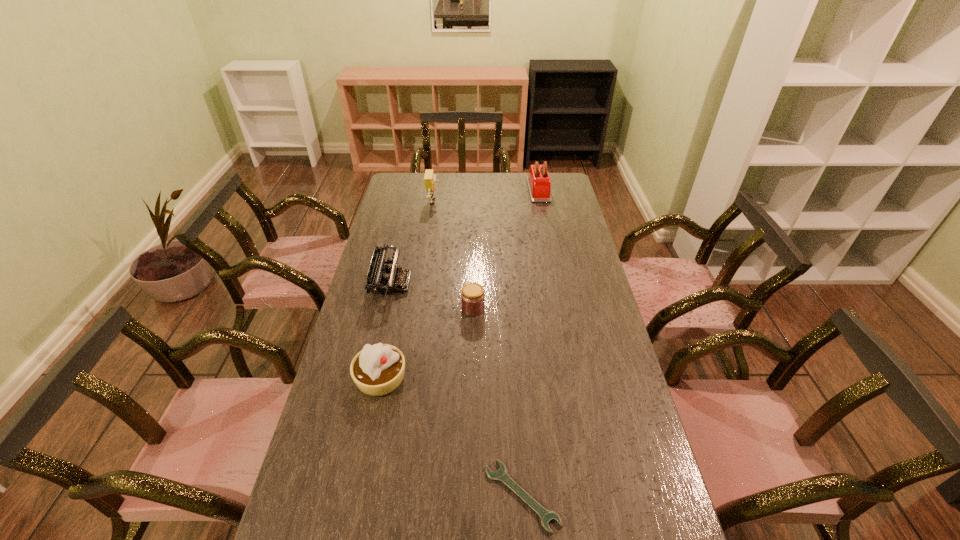
Find the location of a particular element. Image resolution: width=960 pixels, height=540 pixels. sponge is located at coordinates (430, 178).

You are a GUI agent. You are given a task and a screenshot of the screen. Output one action in this format:
    pyautogui.click(x=<x>, y=<y>)
    Task: Click on the rightmost object
    
    Given the screenshot: What is the action you would take?
    pyautogui.click(x=539, y=184)

You are a GUI agent. You are given a task and a screenshot of the screen. Output one action in this format:
    pyautogui.click(x=<x>, y=<y>)
    Task: Click on the second nearest object
    
    Given the screenshot: What is the action you would take?
    [378, 369]

Where is `typewriter`? Image resolution: width=960 pixels, height=540 pixels. typewriter is located at coordinates (380, 279).

At what (x,y) coordinates should I click in order to perform the action: click on the fifth tallest object. Please return your answer as a coordinate pair (x, y). Looking at the image, I should click on (472, 296).

The image size is (960, 540). In order to click on the nearest object in this screenshot , I will do `click(501, 475)`.

Find the location of a particular element. Image resolution: width=960 pixels, height=540 pixels. the shortest object is located at coordinates (501, 475).

Identify the location of vacant region located 0.290m on the face of the sponge. (500, 202).

This screenshot has width=960, height=540. Find the location of `blank area located 0.050m on the back of the rightmost object`. blank area located 0.050m on the back of the rightmost object is located at coordinates (536, 173).

Locate an element on the screen. vacant area situated 0.240m on the back of the whipped cream is located at coordinates (396, 305).